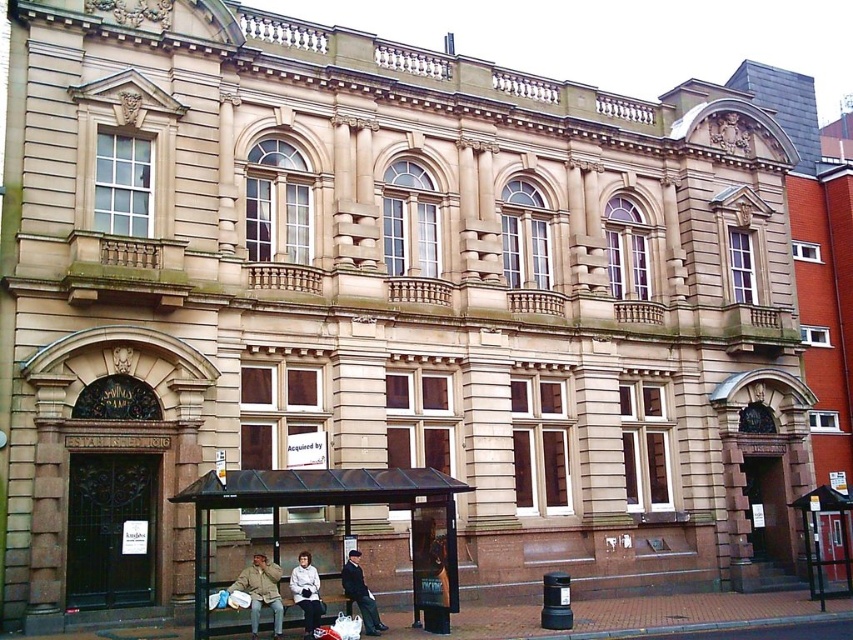
Describe the element at coordinates (260, 592) in the screenshot. I see `khaki fabric jacket at lower center` at that location.

Based on the photo, which is more to the right, khaki fabric jacket at lower center or white fabric coat at lower center?

Positioned to the right is white fabric coat at lower center.

This screenshot has height=640, width=853. What do you see at coordinates (260, 592) in the screenshot?
I see `khaki fabric jacket at lower center` at bounding box center [260, 592].

Locate an element on the screen. The image size is (853, 640). khaki fabric jacket at lower center is located at coordinates (260, 592).

Can you confirm if black metal bus stop at lower left is taller than khaki fabric jacket at lower center?

Yes.

Is point (328, 497) positioned before point (254, 596)?

That is False.

Identify the location of black metal bus stop at lower left. (343, 522).

Between black metal bus stop at lower left and dark blue fabric coat at lower center, which one has less height?

With less height is dark blue fabric coat at lower center.

Consider the image. Who is lower down, black metal bus stop at lower left or dark blue fabric coat at lower center?

dark blue fabric coat at lower center

Is point (373, 484) more distant than point (351, 600)?

No, it is not.

Identify the location of black metal bus stop at lower left. (343, 522).